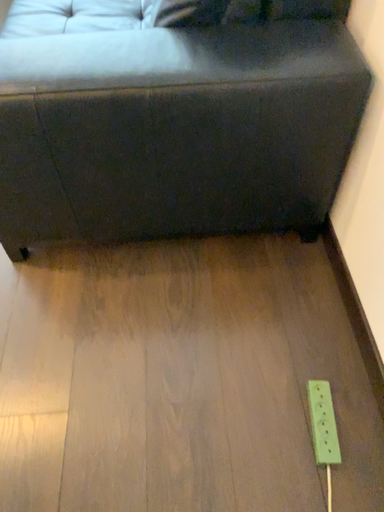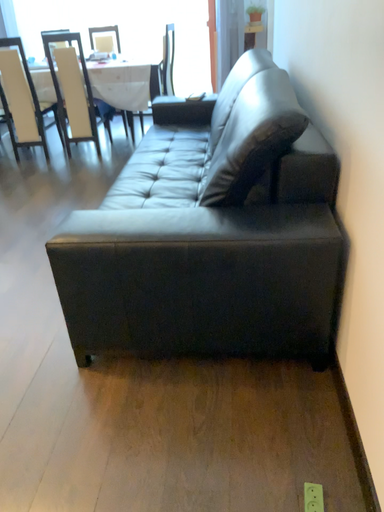
Question: How did the camera likely rotate when shooting the video?

Choices:
 (A) rotated right
 (B) rotated left

Answer: (B)